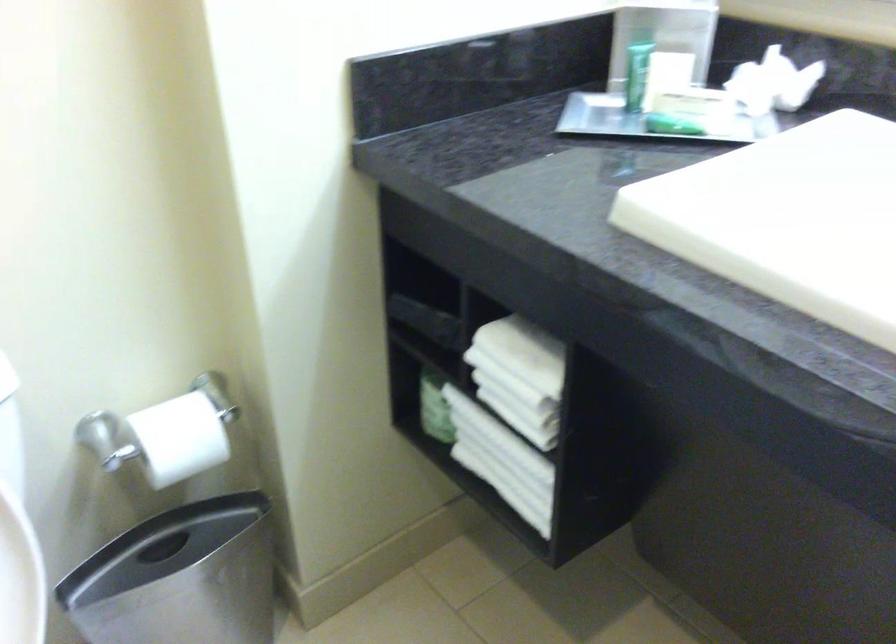
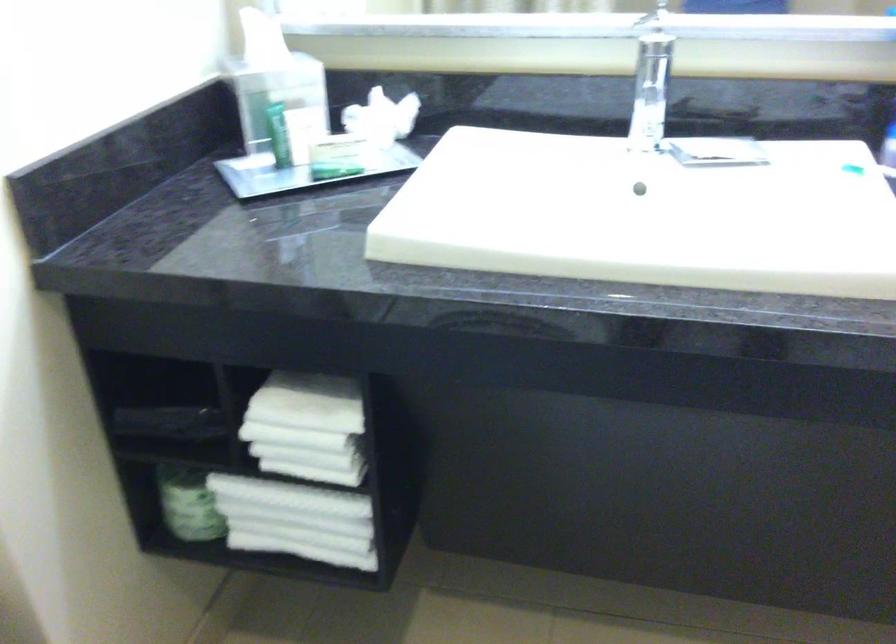
In the second image, find the point that corresponds to the point at 648,122 in the first image.

(303, 172)